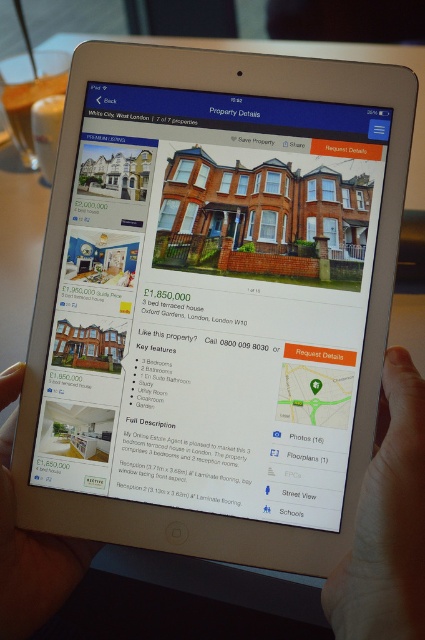
Does skinny white tablet at center have a smaller size compared to matte black hand at lower left?

No, skinny white tablet at center is not smaller than matte black hand at lower left.

Between skinny white tablet at center and matte black hand at lower left, which one appears on the right side from the viewer's perspective?

From the viewer's perspective, skinny white tablet at center appears more on the right side.

The width and height of the screenshot is (425, 640). Find the location of `skinny white tablet at center`. skinny white tablet at center is located at coordinates (387, 522).

Consider the image. Can you confirm if skin tone flesh hand at lower right is shorter than matte black hand at lower left?

Indeed, skin tone flesh hand at lower right has a lesser height compared to matte black hand at lower left.

Locate an element on the screen. This screenshot has height=640, width=425. skin tone flesh hand at lower right is located at coordinates (387, 522).

Does skinny white tablet at center appear over skin tone flesh hand at lower right?

No, skinny white tablet at center is not above skin tone flesh hand at lower right.

What do you see at coordinates (387, 522) in the screenshot? This screenshot has width=425, height=640. I see `skinny white tablet at center` at bounding box center [387, 522].

Identify the location of skinny white tablet at center. This screenshot has height=640, width=425. (387, 522).